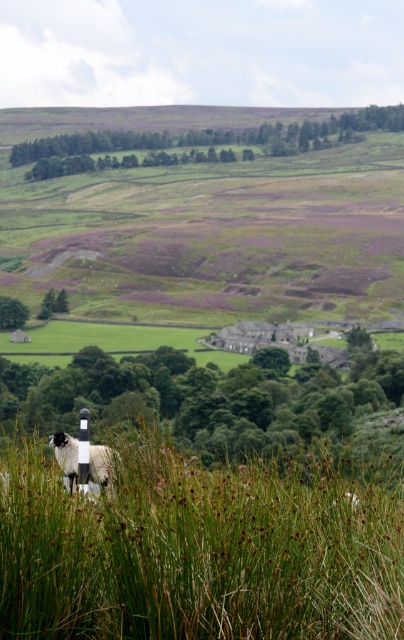
Question: Which of the following is the closest to the observer?

Choices:
 (A) green grassy at lower left
 (B) black and white woolen sheep at lower left

Answer: (A)

Question: Does green grassy at lower left have a lesser width compared to black and white woolen sheep at lower left?

Choices:
 (A) no
 (B) yes

Answer: (A)

Question: Which point is closer to the camera taking this photo?

Choices:
 (A) (151, 628)
 (B) (98, 477)

Answer: (A)

Question: Can you confirm if green grassy at lower left is wider than black and white woolen sheep at lower left?

Choices:
 (A) no
 (B) yes

Answer: (B)

Question: Does green grassy at lower left appear on the right side of black and white woolen sheep at lower left?

Choices:
 (A) yes
 (B) no

Answer: (A)